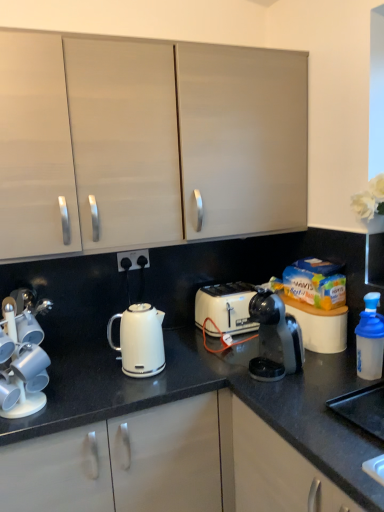
Question: From the image's perspective, does black plastic coffee maker at center appear higher than black granite countertop at center?

Choices:
 (A) yes
 (B) no

Answer: (A)

Question: Can we say black plastic coffee maker at center lies outside black granite countertop at center?

Choices:
 (A) no
 (B) yes

Answer: (B)

Question: Is black plastic coffee maker at center to the right of black granite countertop at center from the viewer's perspective?

Choices:
 (A) no
 (B) yes

Answer: (B)

Question: Is black plastic coffee maker at center wider than black granite countertop at center?

Choices:
 (A) yes
 (B) no

Answer: (B)

Question: From the image's perspective, is black plastic coffee maker at center under black granite countertop at center?

Choices:
 (A) yes
 (B) no

Answer: (B)

Question: Can you confirm if black plastic coffee maker at center is taller than black granite countertop at center?

Choices:
 (A) no
 (B) yes

Answer: (A)

Question: Does white glossy cup holder at left have a larger size compared to white glossy kettle at center?

Choices:
 (A) no
 (B) yes

Answer: (A)

Question: Is white glossy cup holder at left taller than white glossy kettle at center?

Choices:
 (A) no
 (B) yes

Answer: (B)

Question: Is white glossy cup holder at left thinner than white glossy kettle at center?

Choices:
 (A) no
 (B) yes

Answer: (B)

Question: From a real-world perspective, is white glossy cup holder at left on top of white glossy kettle at center?

Choices:
 (A) no
 (B) yes

Answer: (B)

Question: Is white glossy kettle at center located within white glossy cup holder at left?

Choices:
 (A) yes
 (B) no

Answer: (B)

Question: Is white glossy cup holder at left placed right next to white glossy kettle at center?

Choices:
 (A) yes
 (B) no

Answer: (B)

Question: Does white glossy kettle at center have a larger size compared to blue translucent bottle at right?

Choices:
 (A) no
 (B) yes

Answer: (B)